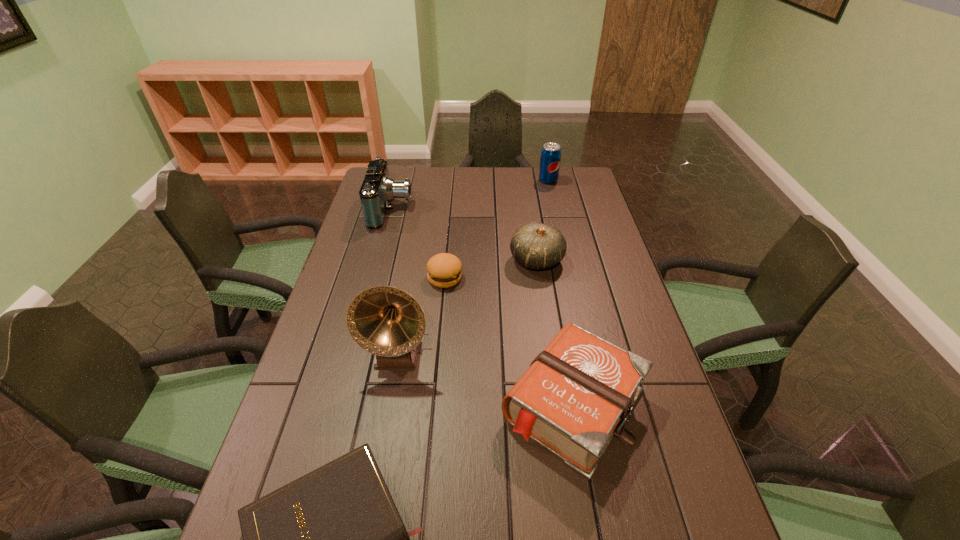
What are the coordinates of `vacant area situated on the left of the right Bible` in the screenshot? It's located at (375, 406).

This screenshot has width=960, height=540. What are the coordinates of `vacant space situated on the front of the hamburger` in the screenshot? It's located at (437, 363).

What are the coordinates of `camcorder that is positioned at the far edge` in the screenshot? It's located at (378, 189).

Where is `pop soda located at the far edge`? The height and width of the screenshot is (540, 960). pop soda located at the far edge is located at coordinates (550, 158).

Locate an element on the screen. This screenshot has width=960, height=540. phonograph record located in the left edge section of the desktop is located at coordinates (386, 321).

Image resolution: width=960 pixels, height=540 pixels. I want to click on camcorder present at the left edge, so click(378, 189).

This screenshot has height=540, width=960. Find the location of `pop soda present at the right edge`. pop soda present at the right edge is located at coordinates (550, 158).

Locate an element on the screen. Image resolution: width=960 pixels, height=540 pixels. Bible that is at the right edge is located at coordinates (576, 395).

You are a GUI agent. You are given a task and a screenshot of the screen. Output one action in this format:
    pyautogui.click(x=<x>, y=<y>)
    Task: Click on the object at the far left corner
    The width and height of the screenshot is (960, 540).
    Given the screenshot: What is the action you would take?
    pyautogui.click(x=378, y=189)

Find the location of `object situated at the far right corner`. object situated at the far right corner is located at coordinates (550, 158).